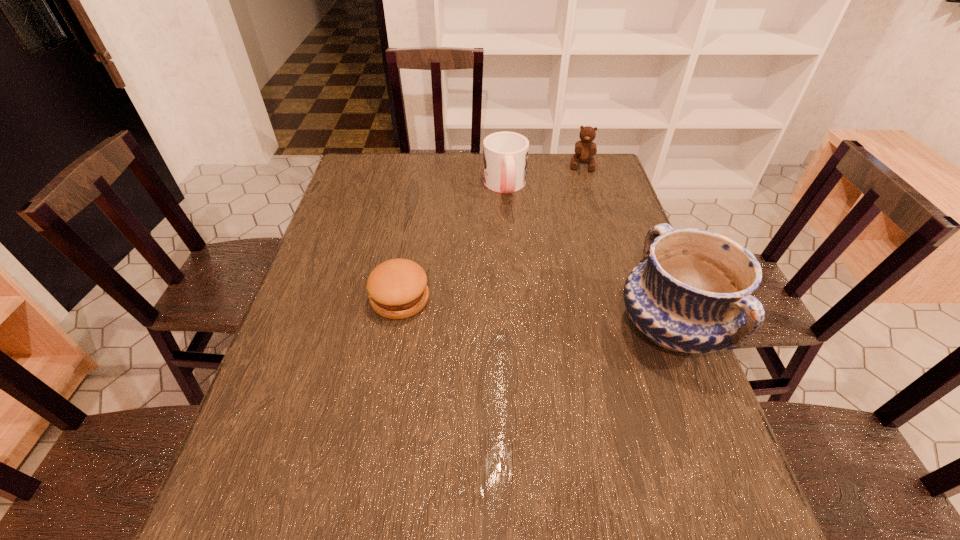
Locate an element on the screen. free point between the pottery and the teddy bear is located at coordinates (627, 246).

The width and height of the screenshot is (960, 540). In order to click on free space between the tallest object and the hamburger in this screenshot , I will do `click(536, 313)`.

Find the location of `blank region between the pottery and the third object from right to left`. blank region between the pottery and the third object from right to left is located at coordinates (588, 256).

What are the coordinates of `vacant area between the shortest object and the tallest object` in the screenshot? It's located at (536, 313).

You are a GUI agent. You are given a task and a screenshot of the screen. Output one action in this format:
    pyautogui.click(x=<x>, y=<y>)
    Task: Click on the free point between the pottery and the teddy bear
    This screenshot has width=960, height=540.
    Given the screenshot: What is the action you would take?
    pyautogui.click(x=627, y=246)

Locate which object ranks in proximity to the leftmost object. Please provide its 2D coordinates. Your answer should be formatted as a tuple, i.e. [(x, y)], where the tuple contains the x and y coordinates of a point satisfying the conditions above.

[(505, 154)]

At what (x,y) coordinates should I click in order to perform the action: click on object that is the third closest one to the pottery. Please return your answer as a coordinate pair (x, y). Looking at the image, I should click on (585, 149).

This screenshot has width=960, height=540. Find the location of `vacant space that satisfies the following two spatial constraints: 1. on the back side of the second object from left to right; 2. on the left side of the hamburger`. vacant space that satisfies the following two spatial constraints: 1. on the back side of the second object from left to right; 2. on the left side of the hamburger is located at coordinates (420, 186).

Where is `free spot that satisfies the following two spatial constraints: 1. on the front side of the leftmost object; 2. on the right side of the pottery`? This screenshot has height=540, width=960. free spot that satisfies the following two spatial constraints: 1. on the front side of the leftmost object; 2. on the right side of the pottery is located at coordinates (396, 327).